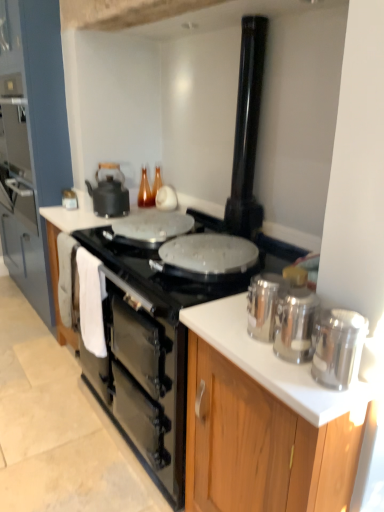
Image resolution: width=384 pixels, height=512 pixels. Identify the location of vacant position to the left of polished stainless steel canisters at right, positioned as the third kitchen appliance in left-to-right order. (241, 348).